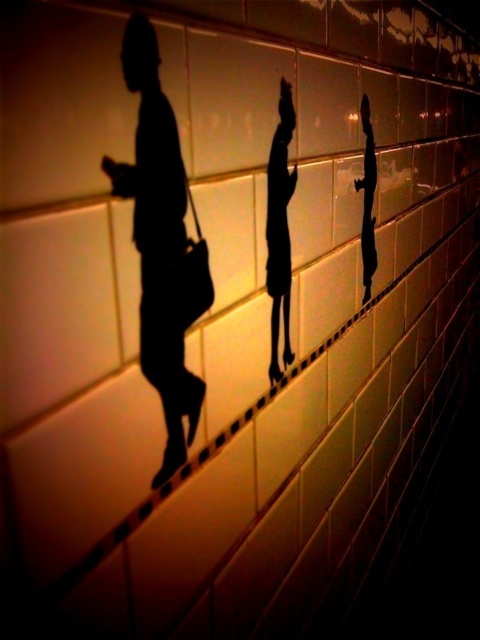
You are standing in front of a wall with rectangular tiles and black grout lines. You see two silhouettes on the wall, the black silhouette at left and the black matte silhouette at center. Which silhouette is closer to the left edge of the wall?

The black silhouette at left is closer to the left edge of the wall since it is positioned to the left of the black matte silhouette at center.

In the dimly lit scene with rectangular tiles and a horizontal grout line, you notice two silhouettes against the wall. The first is the black silhouette at left holding a bag, and the second is the black matte silhouette at center walking forward. Which silhouette appears taller?

The black silhouette at left appears much taller than the black matte silhouette at center.

You are a security guard observing the scene described. You notice two figures, the black silhouette at left and the black matte silhouette at center. Which one appears bigger in size?

The black silhouette at left appears bigger in size compared to the black matte silhouette at center.